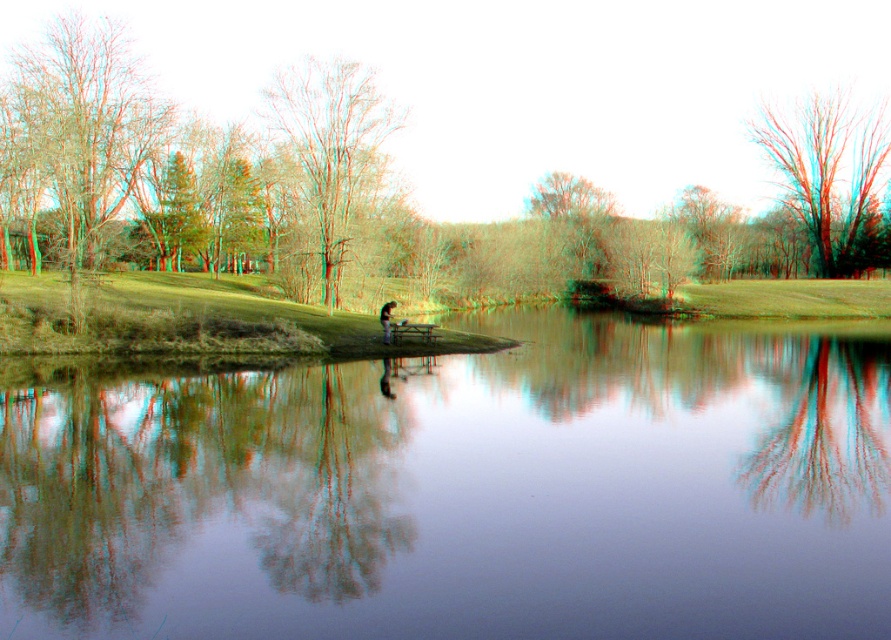
Can you confirm if transparent glass water at center is wider than smooth bark tree at left?

Indeed, transparent glass water at center has a greater width compared to smooth bark tree at left.

Does transparent glass water at center come in front of smooth bark tree at left?

That is True.

What do you see at coordinates (462, 492) in the screenshot?
I see `transparent glass water at center` at bounding box center [462, 492].

Where is `transparent glass water at center`? The image size is (891, 640). transparent glass water at center is located at coordinates (462, 492).

Does transparent glass water at center have a lesser height compared to smooth brown tree at center?

Correct, transparent glass water at center is not as tall as smooth brown tree at center.

Describe the element at coordinates (462, 492) in the screenshot. I see `transparent glass water at center` at that location.

Locate an element on the screen. transparent glass water at center is located at coordinates (462, 492).

Can you confirm if transparent glass water at center is positioned above dark brown wooden bench at center?

No, transparent glass water at center is not above dark brown wooden bench at center.

Between transparent glass water at center and dark brown wooden bench at center, which one appears on the left side from the viewer's perspective?

dark brown wooden bench at center

Is point (39, 605) behind point (389, 333)?

No, it is not.

Locate an element on the screen. transparent glass water at center is located at coordinates (462, 492).